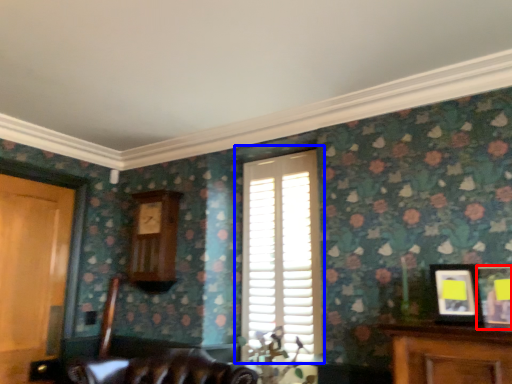
Question: Which object appears closest to the camera in this image, picture frame (highlighted by a red box) or window (highlighted by a blue box)?

Choices:
 (A) picture frame
 (B) window

Answer: (A)